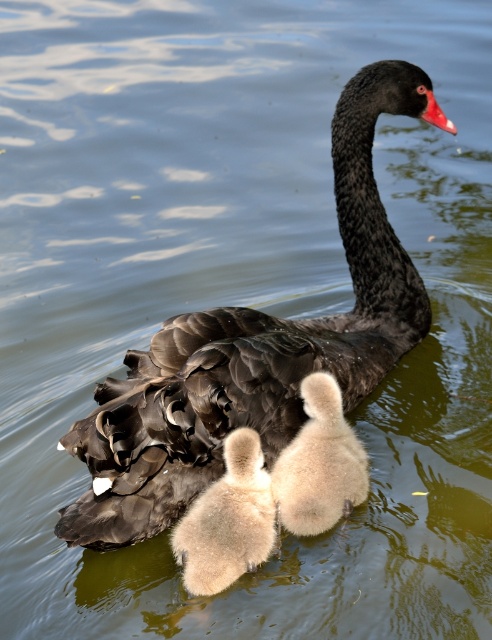
Question: Which object appears farthest from the camera in this image?

Choices:
 (A) fluffy white duckling at center
 (B) soft beige duckling at center
 (C) black glossy swan at center

Answer: (A)

Question: Which point is farther from the camera taking this photo?

Choices:
 (A) (243, 513)
 (B) (391, 314)
 (C) (367, 458)

Answer: (B)

Question: Can you confirm if black glossy swan at center is positioned to the left of fluffy white duckling at center?

Choices:
 (A) yes
 (B) no

Answer: (A)

Question: Which of the following is the closest to the observer?

Choices:
 (A) fluffy white duckling at center
 (B) soft beige duckling at center

Answer: (B)

Question: Can you confirm if black glossy swan at center is wider than soft beige duckling at center?

Choices:
 (A) yes
 (B) no

Answer: (A)

Question: Does black glossy swan at center have a smaller size compared to fluffy white duckling at center?

Choices:
 (A) no
 (B) yes

Answer: (A)